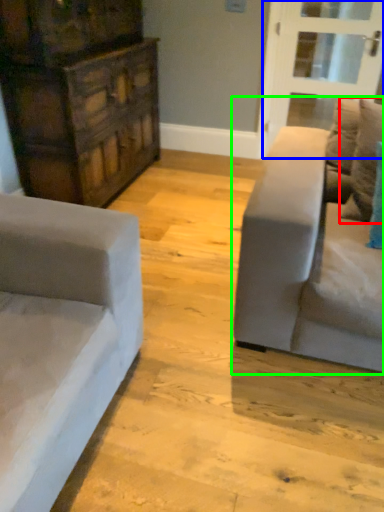
Question: Which is farther away from pillow (highlighted by a red box)? glass door (highlighted by a blue box) or studio couch (highlighted by a green box)?

Choices:
 (A) glass door
 (B) studio couch

Answer: (A)